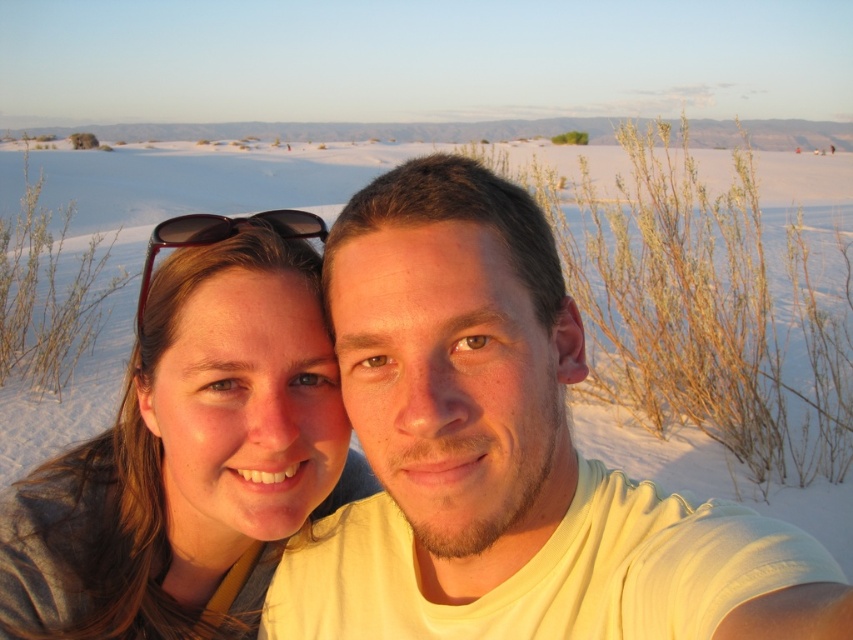
Question: Among these objects, which one is nearest to the camera?

Choices:
 (A) matte gray hair at left
 (B) black matte sunglasses at upper left
 (C) yellow cotton shirt at center

Answer: (C)

Question: Does matte gray hair at left appear on the left side of black matte sunglasses at upper left?

Choices:
 (A) yes
 (B) no

Answer: (B)

Question: Is matte gray hair at left to the left of black matte sunglasses at upper left from the viewer's perspective?

Choices:
 (A) yes
 (B) no

Answer: (B)

Question: Which object is the closest to the black matte sunglasses at upper left?

Choices:
 (A) yellow cotton shirt at center
 (B) matte gray hair at left

Answer: (B)

Question: Which point is farther to the camera?

Choices:
 (A) (241, 600)
 (B) (218, 241)

Answer: (A)

Question: Is matte gray hair at left closer to camera compared to black matte sunglasses at upper left?

Choices:
 (A) yes
 (B) no

Answer: (A)